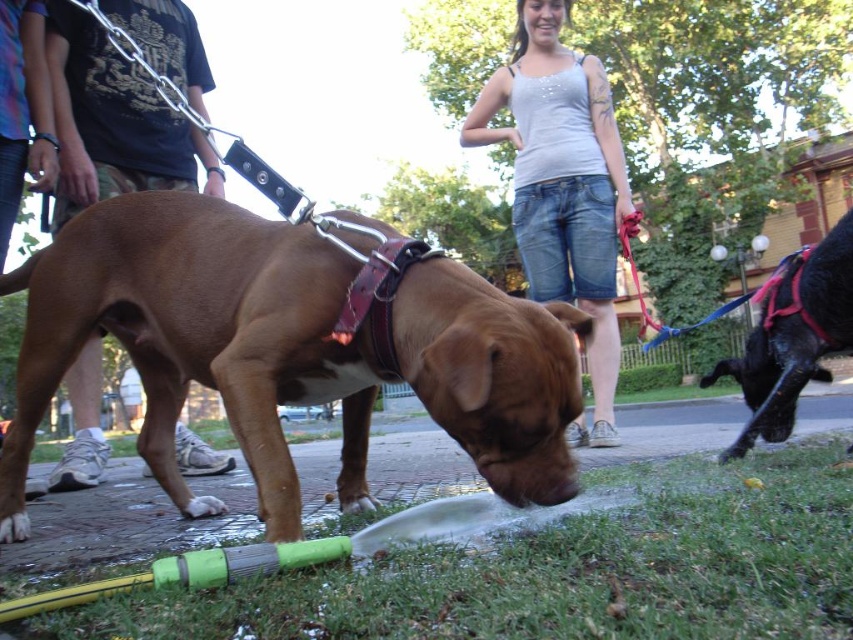
Is denim shorts at center to the right of brown leather leash at left from the viewer's perspective?

Yes, denim shorts at center is to the right of brown leather leash at left.

Can you confirm if denim shorts at center is positioned to the left of brown leather leash at left?

Incorrect, denim shorts at center is not on the left side of brown leather leash at left.

Which is behind, point (523, 68) or point (88, 147)?

Positioned behind is point (523, 68).

The width and height of the screenshot is (853, 640). Find the location of `denim shorts at center`. denim shorts at center is located at coordinates (563, 186).

Does denim shorts at center have a greater height compared to shiny black dog at right?

Yes, denim shorts at center is taller than shiny black dog at right.

The height and width of the screenshot is (640, 853). What are the coordinates of `denim shorts at center` in the screenshot? It's located at (563, 186).

Is brown leather leash at left further to the viewer compared to shiny black dog at right?

Yes, it is.

Is point (163, 35) closer to camera compared to point (770, 355)?

No, it is behind (770, 355).

You are a GUI agent. You are given a task and a screenshot of the screen. Output one action in this format:
    pyautogui.click(x=<x>, y=<y>)
    Task: Click on the brown leather leash at left
    The image size is (853, 640).
    Given the screenshot: What is the action you would take?
    pyautogui.click(x=113, y=122)